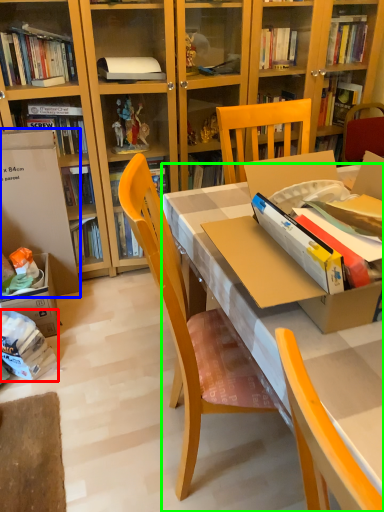
Question: Which object is positioned farthest from book (highlighted by a red box)? Select from leftover (highlighted by a blue box) and desk (highlighted by a green box).

Choices:
 (A) leftover
 (B) desk

Answer: (B)